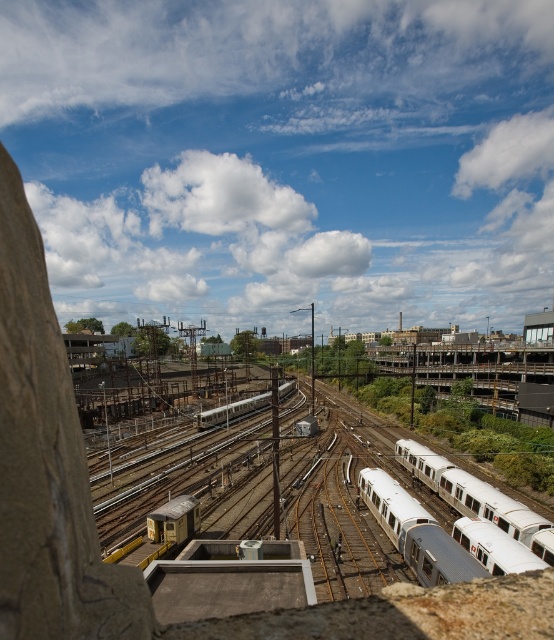
You are a train engineer who needs to inspect the silver metallic train at right and the white glossy train at center. According to the scene, which train is positioned higher in the image?

The silver metallic train at right is located above the white glossy train at center, so it is positioned higher in the image.

You are a railway engineer planning to move a new train into the yard. The new train is exactly the same size as the silver metallic train at right. If you want to place the new train in the same position relative to the concrete structure in the foreground, where should you position it?

The silver metallic train at right is located at point [469,492], so you should position the new train at the same coordinates to match its placement relative to the concrete structure in the foreground.